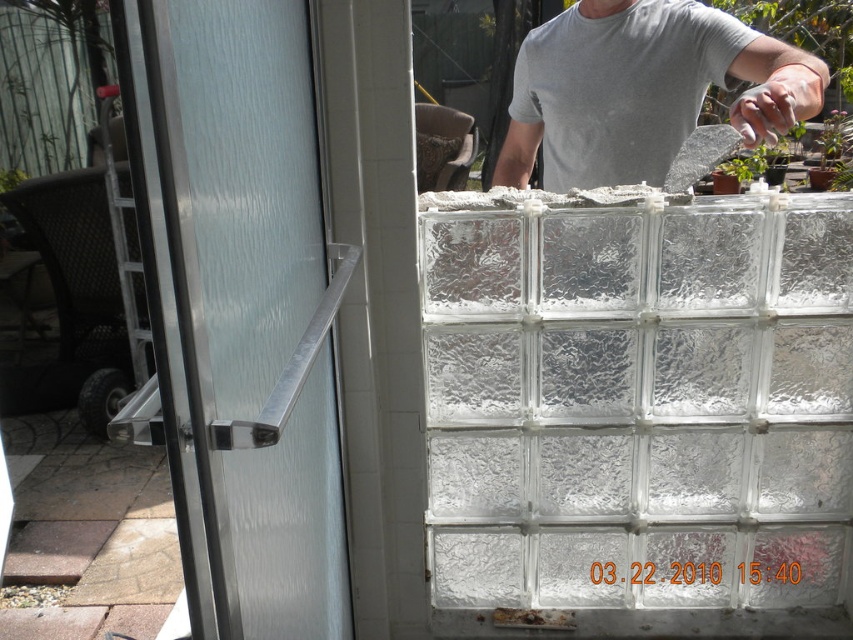
Question: Is frosted glass door handle at left above gray matte shirt at upper center?

Choices:
 (A) yes
 (B) no

Answer: (B)

Question: Which point is closer to the camera taking this photo?

Choices:
 (A) (660, 36)
 (B) (312, 468)

Answer: (B)

Question: Which point is farther to the camera?

Choices:
 (A) gray matte shirt at upper center
 (B) frosted glass door handle at left

Answer: (A)

Question: In this image, where is frosted glass door handle at left located relative to gray matte shirt at upper center?

Choices:
 (A) below
 (B) above

Answer: (A)

Question: Is frosted glass door handle at left positioned at the back of gray matte shirt at upper center?

Choices:
 (A) yes
 (B) no

Answer: (B)